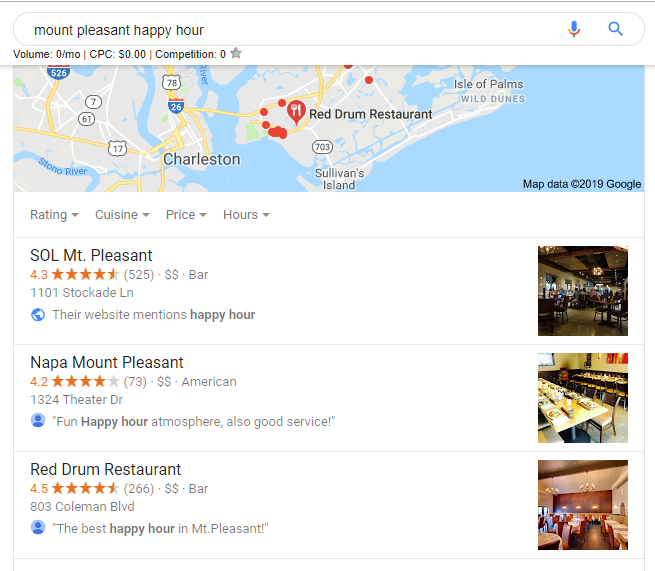
Where is `ceiling`? This screenshot has height=571, width=655. ceiling is located at coordinates (574, 262).